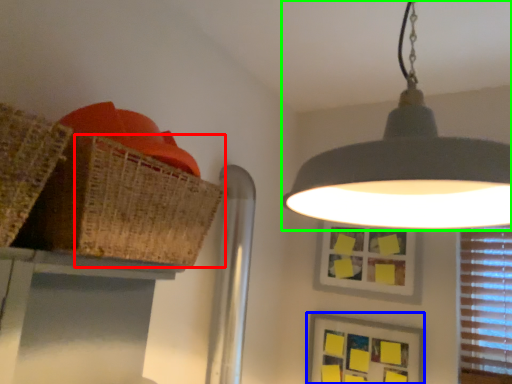
Question: Considering the real-world distances, which object is farthest from basket (highlighted by a red box)? picture frame (highlighted by a blue box) or lamp (highlighted by a green box)?

Choices:
 (A) picture frame
 (B) lamp

Answer: (A)